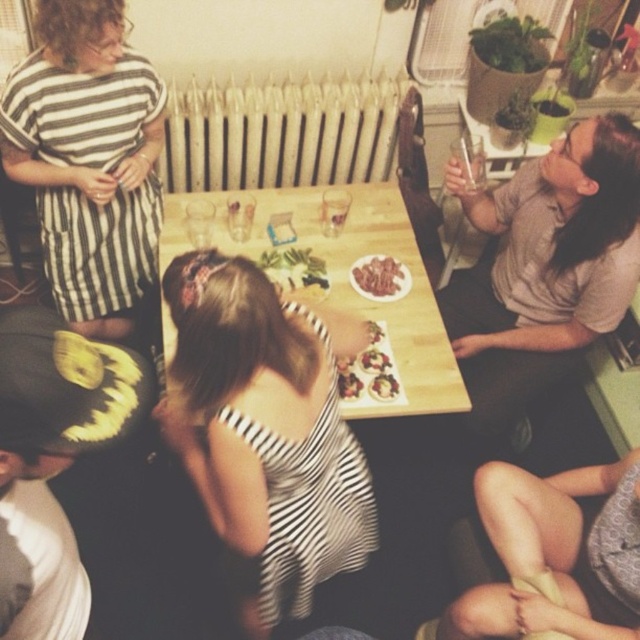
Question: Estimate the real-world distances between objects in this image. Which object is farther from the smooth white plate at center?

Choices:
 (A) meat chunks at center
 (B) skinny jeans at lower right
 (C) shiny metallic fork at center
 (D) gray cotton shirt at upper right

Answer: (D)

Question: Considering the relative positions of green leafy salad at center and smooth white plate at center in the image provided, where is green leafy salad at center located with respect to smooth white plate at center?

Choices:
 (A) above
 (B) below

Answer: (A)

Question: Considering the real-world distances, which object is closest to the meat chunks at center?

Choices:
 (A) metallic radiator at center
 (B) skinny jeans at lower right
 (C) striped fabric dress at upper left
 (D) striped fabric dress at center

Answer: (D)

Question: Among these points, which one is farthest from the camera?

Choices:
 (A) (148, 150)
 (B) (476, 378)

Answer: (B)

Question: Considering the relative positions of striped fabric dress at upper left and skinny jeans at lower right in the image provided, where is striped fabric dress at upper left located with respect to skinny jeans at lower right?

Choices:
 (A) below
 (B) above

Answer: (B)

Question: Is striped fabric dress at center to the right of shiny metallic fork at center from the viewer's perspective?

Choices:
 (A) yes
 (B) no

Answer: (B)